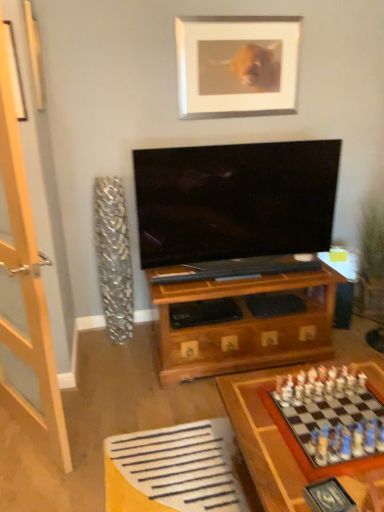
What are the coordinates of `free spot to the right of clear glass door at left` in the screenshot? It's located at (117, 428).